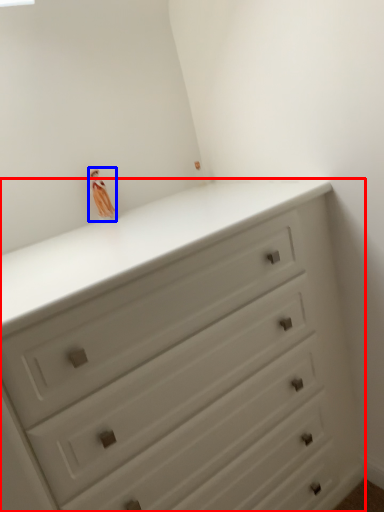
Question: Which object is closer to the camera taking this photo, chest of drawers (highlighted by a red box) or miniature (highlighted by a blue box)?

Choices:
 (A) chest of drawers
 (B) miniature

Answer: (A)